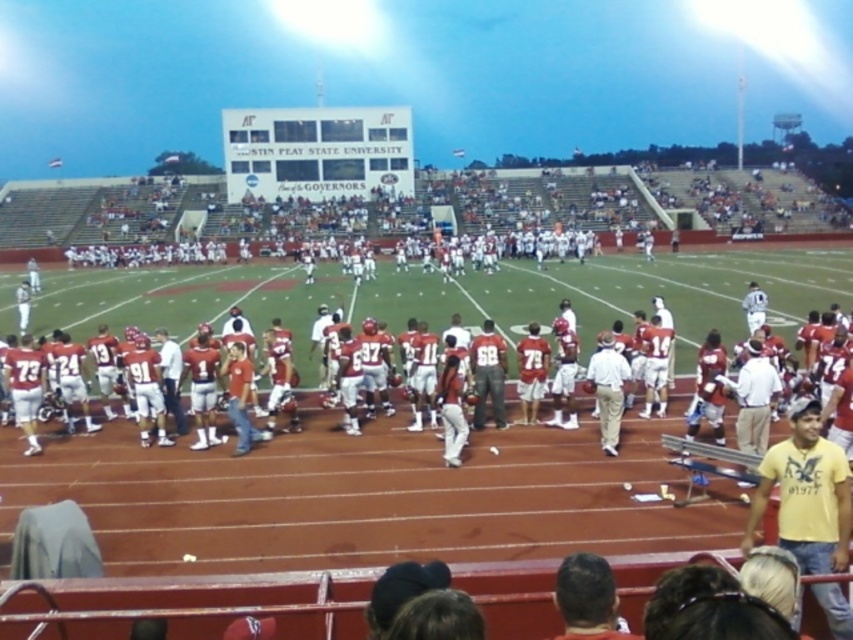
Between yellow cotton shirt at lower right and matte gray pants at center, which one is positioned higher?

Positioned higher is matte gray pants at center.

Can you confirm if yellow cotton shirt at lower right is positioned to the left of matte gray pants at center?

Incorrect, yellow cotton shirt at lower right is not on the left side of matte gray pants at center.

This screenshot has width=853, height=640. What do you see at coordinates (805, 493) in the screenshot?
I see `yellow cotton shirt at lower right` at bounding box center [805, 493].

You are a GUI agent. You are given a task and a screenshot of the screen. Output one action in this format:
    pyautogui.click(x=<x>, y=<y>)
    Task: Click on the yellow cotton shirt at lower right
    
    Given the screenshot: What is the action you would take?
    pyautogui.click(x=805, y=493)

Between yellow cotton shirt at lower right and white cotton shirt at center, which one appears on the left side from the viewer's perspective?

white cotton shirt at center

Between point (833, 456) and point (618, 360), which one is positioned in front?

Point (833, 456)

In order to click on yellow cotton shirt at lower right in this screenshot , I will do `click(805, 493)`.

Is point (619, 401) closer to viewer compared to point (486, 362)?

That is True.

Which of these two, white cotton shirt at center or matte gray pants at center, stands taller?

white cotton shirt at center

Is point (607, 388) positioned before point (476, 346)?

Yes, point (607, 388) is in front of point (476, 346).

Identify the location of white cotton shirt at center. (608, 388).